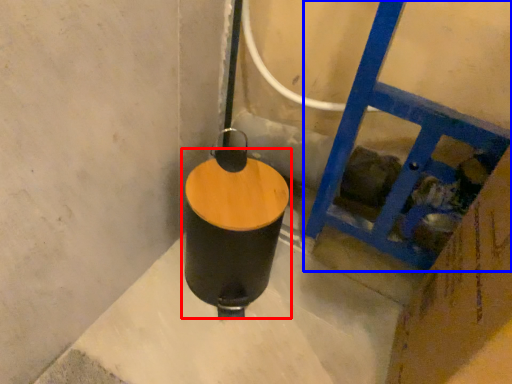
Question: Among these objects, which one is nearest to the camera, waste container (highlighted by a red box) or ladder (highlighted by a blue box)?

Choices:
 (A) waste container
 (B) ladder

Answer: (B)